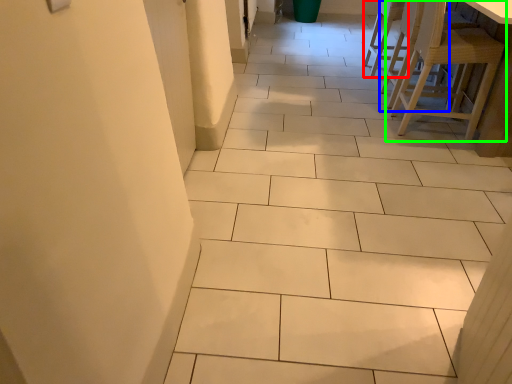
Question: Which is farther away from chair (highlighted by a red box)? chair (highlighted by a blue box) or chair (highlighted by a green box)?

Choices:
 (A) chair
 (B) chair

Answer: (B)